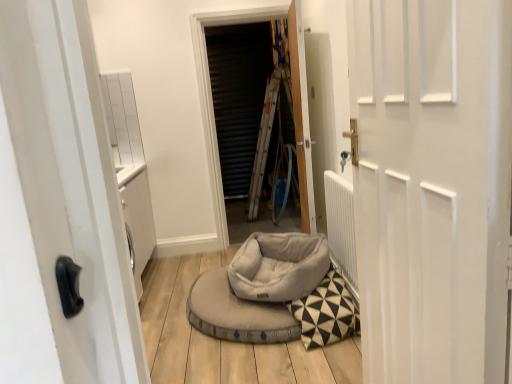
What is the approximate height of soft gray fabric bean bag at center?

12.69 inches.

What do you see at coordinates (211, 90) in the screenshot? The width and height of the screenshot is (512, 384). I see `metallic silver screen at center` at bounding box center [211, 90].

Identify the location of soft gray fabric bean bag at center. (278, 266).

The image size is (512, 384). I want to click on door lying in front of the wooden door at center, the first door viewed from the back, so click(x=432, y=186).

Could you tell me if white matte door at center, which is the 2th door from back to front, is facing wooden door at center, the first door viewed from the back?

No, white matte door at center, which is the 2th door from back to front, does not turn towards wooden door at center, the first door viewed from the back.

Between wooden door at center, the first door viewed from the back, and metallic silver screen at center, which one has smaller size?

Smaller between the two is wooden door at center, the first door viewed from the back.

Is wooden door at center, positioned as the 2th door in front-to-back order, taller or shorter than metallic silver screen at center?

In the image, wooden door at center, positioned as the 2th door in front-to-back order, appears to be shorter than metallic silver screen at center.

How much distance is there between wooden door at center, the first door viewed from the back, and metallic silver screen at center?

They are 66.88 centimeters apart.

Is the depth of wooden door at center, the first door viewed from the back, less than that of metallic silver screen at center?

Yes, wooden door at center, the first door viewed from the back, is closer to the viewer.

From the image's perspective, which one is positioned lower, soft gray fabric bean bag at center or white matte door at center, which is counted as the 1th door, starting from the front?

soft gray fabric bean bag at center, from the image's perspective.

Which is more to the right, soft gray fabric bean bag at center or white matte door at center, which is counted as the 1th door, starting from the front?

From the viewer's perspective, white matte door at center, which is counted as the 1th door, starting from the front, appears more on the right side.

Is soft gray fabric bean bag at center positioned beyond the bounds of white matte door at center, which is counted as the 1th door, starting from the front?

Yes, soft gray fabric bean bag at center is not within white matte door at center, which is counted as the 1th door, starting from the front.

How many degrees apart are the facing directions of metallic silver screen at center and white matte door at center, which is the 2th door from back to front?

87.7 degrees separate the facing orientations of metallic silver screen at center and white matte door at center, which is the 2th door from back to front.

Relative to white matte door at center, which is the 2th door from back to front, is metallic silver screen at center in front or behind?

metallic silver screen at center is positioned farther from the viewer than white matte door at center, which is the 2th door from back to front.

Can you confirm if metallic silver screen at center is bigger than white matte door at center, which is counted as the 1th door, starting from the front?

Correct, metallic silver screen at center is larger in size than white matte door at center, which is counted as the 1th door, starting from the front.

Is metallic silver screen at center at the left side of white matte door at center, which is counted as the 1th door, starting from the front?

Yes.

Is point (301, 206) closer or farther from the camera than point (284, 250)?

Point (301, 206).

From a real-world perspective, is wooden door at center, the first door viewed from the back, below soft gray fabric bean bag at center?

Actually, wooden door at center, the first door viewed from the back, is physically above soft gray fabric bean bag at center in the real world.

Which of these two, wooden door at center, the first door viewed from the back, or soft gray fabric bean bag at center, is thinner?

With smaller width is wooden door at center, the first door viewed from the back.

Can you tell me how much soft gray fabric bean bag at center and wooden door at center, positioned as the 2th door in front-to-back order, differ in facing direction?

The angular difference between soft gray fabric bean bag at center and wooden door at center, positioned as the 2th door in front-to-back order, is 71.1 degrees.

Is point (294, 246) less distant than point (312, 212)?

Yes, it is in front of point (312, 212).

Considering the sizes of soft gray fabric bean bag at center and wooden door at center, the first door viewed from the back, in the image, is soft gray fabric bean bag at center bigger or smaller than wooden door at center, the first door viewed from the back,?

Clearly, soft gray fabric bean bag at center is smaller in size than wooden door at center, the first door viewed from the back.

Is soft gray fabric bean bag at center far from wooden door at center, positioned as the 2th door in front-to-back order?

They are positioned close to each other.

Is soft gray fabric bean bag at center inside or outside of metallic silver screen at center?

soft gray fabric bean bag at center cannot be found inside metallic silver screen at center.

Is soft gray fabric bean bag at center thinner than metallic silver screen at center?

In fact, soft gray fabric bean bag at center might be wider than metallic silver screen at center.

Which of these two, soft gray fabric bean bag at center or metallic silver screen at center, is bigger?

metallic silver screen at center is bigger.

From a real-world perspective, is soft gray fabric bean bag at center positioned above or below metallic silver screen at center?

soft gray fabric bean bag at center is situated lower than metallic silver screen at center in the real world.

What are the coordinates of `door behind the white matte door at center, which is the 2th door from back to front` in the screenshot? It's located at (301, 116).

You are a GUI agent. You are given a task and a screenshot of the screen. Output one action in this format:
    pyautogui.click(x=<x>, y=<y>)
    Task: Click on the 1st door located beneath the metallic silver screen at center (from a real-world perspective)
    This screenshot has width=512, height=384.
    Given the screenshot: What is the action you would take?
    pyautogui.click(x=301, y=116)

Consider the image. Based on their spatial positions, is soft gray fabric bean bag at center or metallic silver screen at center further from wooden door at center, positioned as the 2th door in front-to-back order?

soft gray fabric bean bag at center lies further to wooden door at center, positioned as the 2th door in front-to-back order, than the other object.

Considering their positions, is metallic silver screen at center positioned closer to wooden door at center, positioned as the 2th door in front-to-back order, than soft gray fabric bean bag at center?

metallic silver screen at center is closer to wooden door at center, positioned as the 2th door in front-to-back order.

Which object lies further to the anchor point soft gray fabric bean bag at center, wooden door at center, positioned as the 2th door in front-to-back order, or metallic silver screen at center?

metallic silver screen at center.

Based on their spatial positions, is wooden door at center, the first door viewed from the back, or metallic silver screen at center closer to white matte door at center, which is the 2th door from back to front?

Among the two, wooden door at center, the first door viewed from the back, is located nearer to white matte door at center, which is the 2th door from back to front.

Looking at the image, which one is located further to metallic silver screen at center, white matte door at center, which is counted as the 1th door, starting from the front, or wooden door at center, the first door viewed from the back?

Among the two, white matte door at center, which is counted as the 1th door, starting from the front, is located further to metallic silver screen at center.

Based on the photo, based on their spatial positions, is soft gray fabric bean bag at center or white matte door at center, which is counted as the 1th door, starting from the front, closer to wooden door at center, positioned as the 2th door in front-to-back order?

Based on the image, soft gray fabric bean bag at center appears to be nearer to wooden door at center, positioned as the 2th door in front-to-back order.

Estimate the real-world distances between objects in this image. Which object is closer to soft gray fabric bean bag at center, metallic silver screen at center or wooden door at center, positioned as the 2th door in front-to-back order?

wooden door at center, positioned as the 2th door in front-to-back order, lies closer to soft gray fabric bean bag at center than the other object.

When comparing their distances from white matte door at center, which is the 2th door from back to front, does metallic silver screen at center or soft gray fabric bean bag at center seem closer?

soft gray fabric bean bag at center.

At what (x,y) coordinates should I click in order to perform the action: click on door between white matte door at center, which is counted as the 1th door, starting from the front, and metallic silver screen at center, along the z-axis. Please return your answer as a coordinate pair (x, y). The height and width of the screenshot is (384, 512). Looking at the image, I should click on (301, 116).

At what (x,y) coordinates should I click in order to perform the action: click on bean bag chair between white matte door at center, which is the 2th door from back to front, and metallic silver screen at center, along the z-axis. Please return your answer as a coordinate pair (x, y). Looking at the image, I should click on (278, 266).

Identify the location of door positioned between soft gray fabric bean bag at center and metallic silver screen at center from near to far. This screenshot has height=384, width=512. (301, 116).

Locate an element on the screen. This screenshot has width=512, height=384. bean bag chair located between white matte door at center, which is the 2th door from back to front, and wooden door at center, positioned as the 2th door in front-to-back order, in the depth direction is located at coordinates (278, 266).